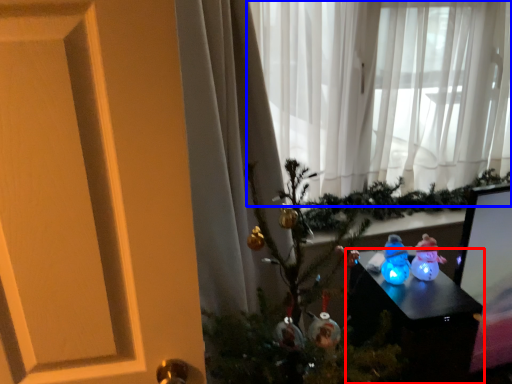
Question: Which object appears farthest to the camera in this image, furniture (highlighted by a red box) or curtain (highlighted by a blue box)?

Choices:
 (A) furniture
 (B) curtain

Answer: (B)